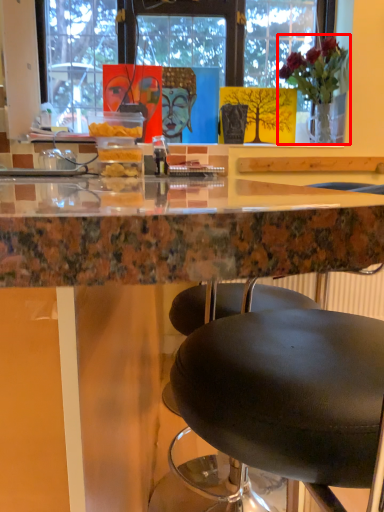
Question: In this image, where is houseplant (annotated by the red box) located relative to table?

Choices:
 (A) right
 (B) left

Answer: (A)